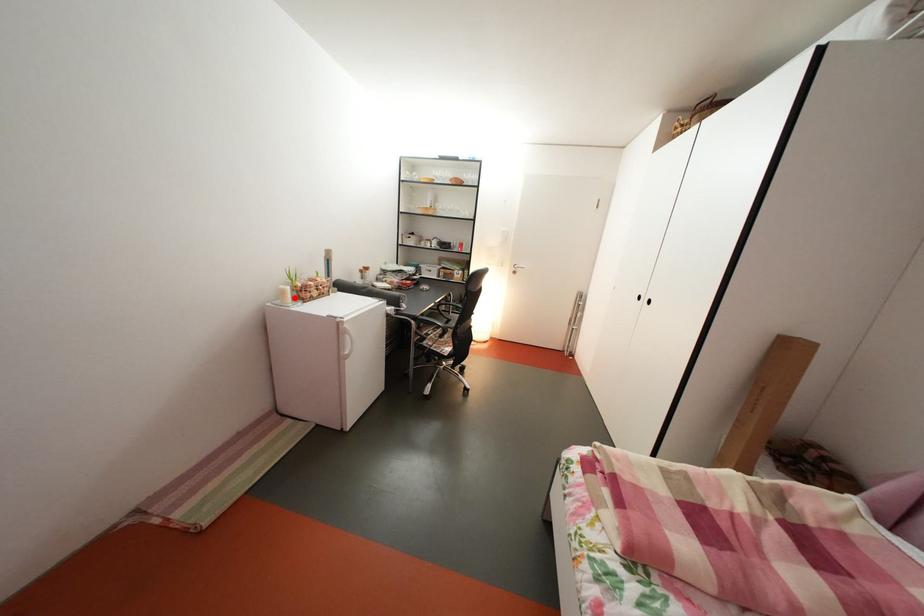
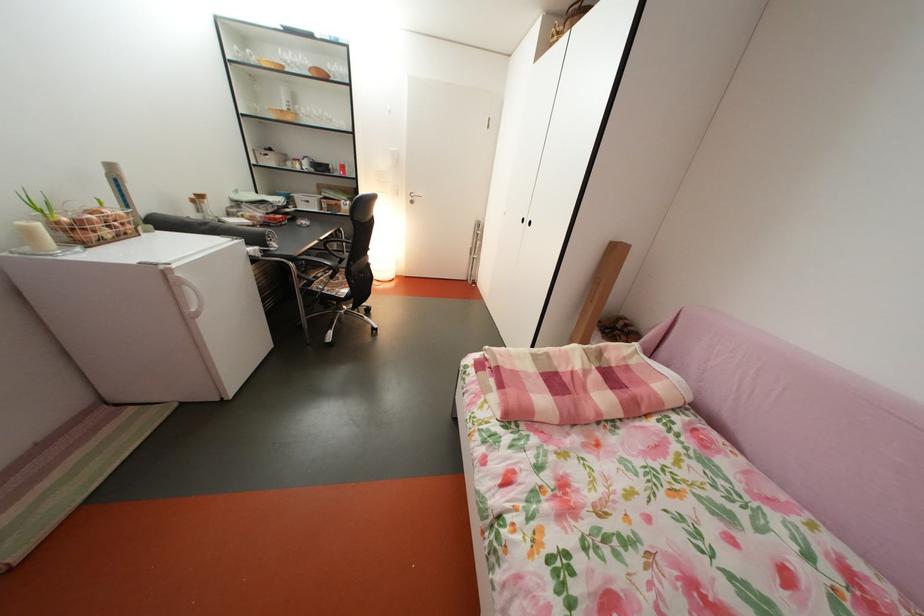
In the second image, find the point that corresponds to the highlighted location in the first image.

(41, 238)